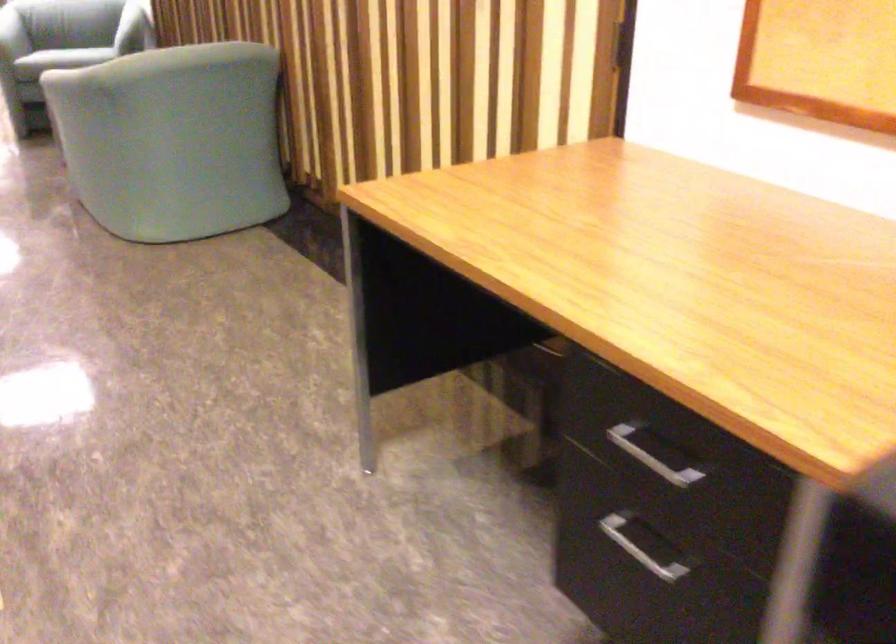
Identify the location of chair sitting surface. (x=66, y=57).